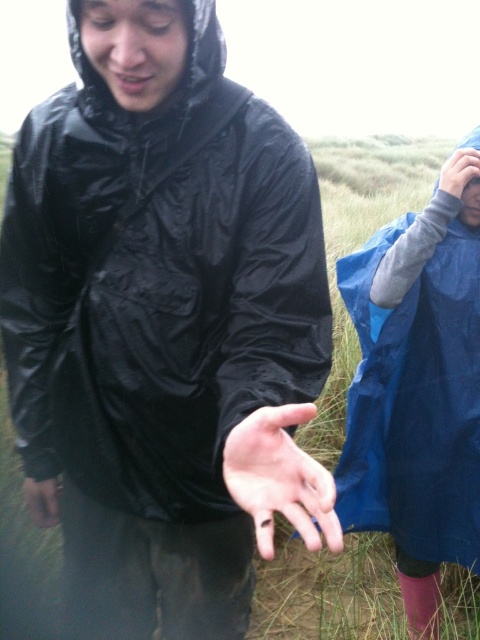
You are a photographer trying to capture a clear photo of the matte blue glove at right. However, the black shiny jacket at center is blocking your view. Can you move around to the left side to get an unobstructed shot?

A: The black shiny jacket at center is in front of the matte blue glove at right, so moving to the left side might allow you to see around the jacket and get an unobstructed view of the matte blue glove at right.

You are a photographer trying to capture a closeup of the smooth skin palm at center and the matte black hand at lower left in the scene. Since you want both to be clearly visible, which object should you focus on first to ensure proper focus, considering their sizes?

The smooth skin palm at center is bigger than matte black hand at lower left, so you should focus on the smooth skin palm at center first to ensure it is in focus, as larger objects often require more precise focus adjustments.

You are a photographer trying to capture both the black shiny jacket at center and the blue waterproof jacket at right in a single frame. Based on their positions, which jacket is closer to the camera?

The black shiny jacket at center is closer to the camera because it is located above the blue waterproof jacket at right, indicating it is in front in the scene.